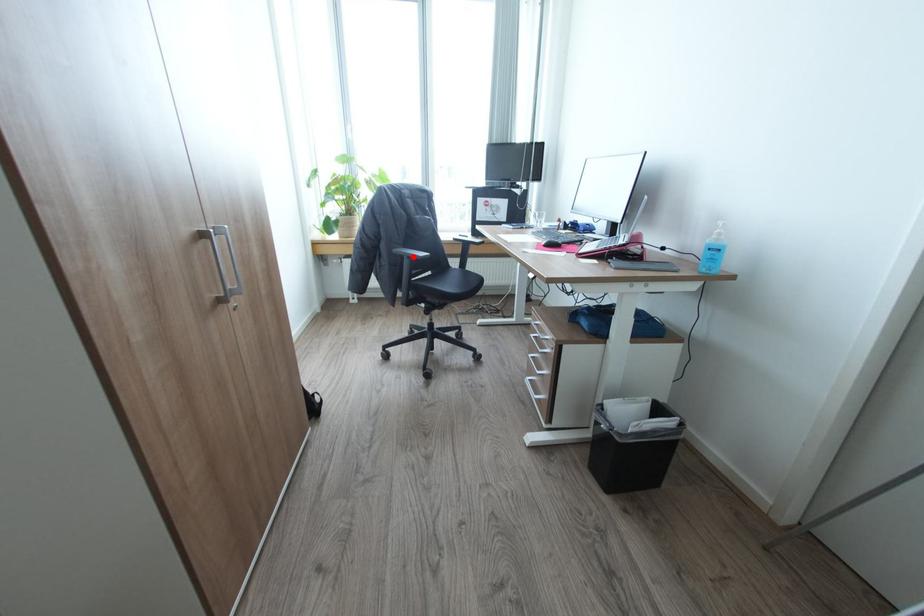
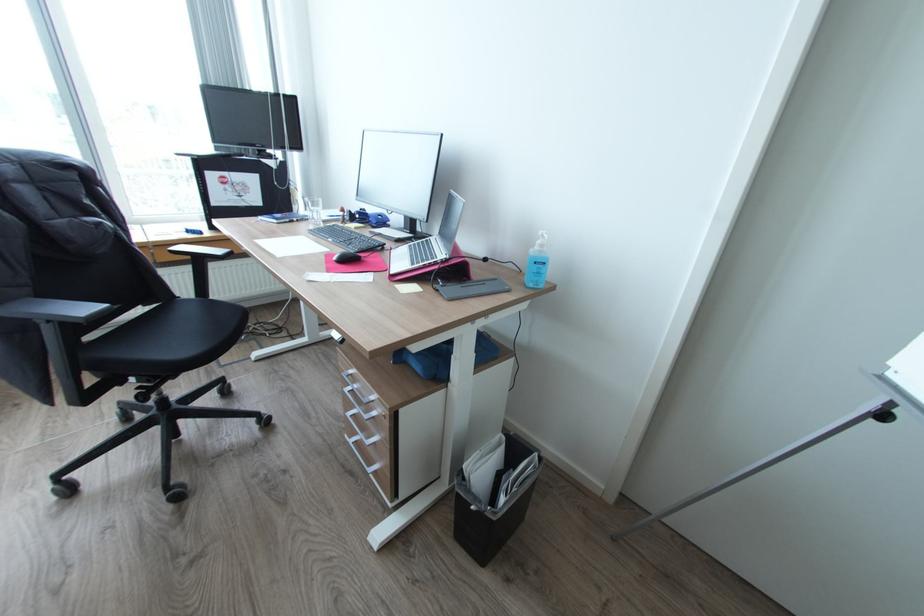
Question: I am providing you with two images of the same scene from different viewpoints. A red point is shown in image1. For the corresponding object point in image2, is it positioned nearer or farther from the camera?

Choices:
 (A) Nearer
 (B) Farther

Answer: (B)